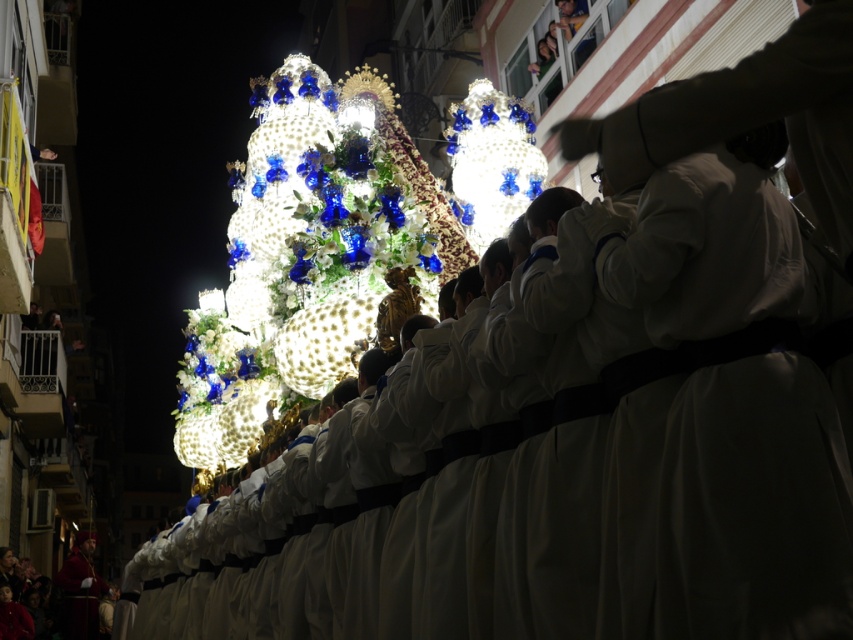
Is point (318, 310) more distant than point (490, 92)?

No.

Is illuminated glass christmas tree at center thinner than iridescent glass ornament at center?

Incorrect, illuminated glass christmas tree at center's width is not less than iridescent glass ornament at center's.

Which is behind, point (399, 189) or point (476, 113)?

Point (476, 113)

Find the location of a particular element. illuminated glass christmas tree at center is located at coordinates (297, 262).

Does illuminated glass christmas tree at center come in front of velvet red robe at lower left?

Yes.

Does illuminated glass christmas tree at center appear on the left side of velvet red robe at lower left?

No, illuminated glass christmas tree at center is not to the left of velvet red robe at lower left.

Measure the distance between point (259, 92) and camera.

A distance of 125.22 meters exists between point (259, 92) and camera.

The height and width of the screenshot is (640, 853). What are the coordinates of `illuminated glass christmas tree at center` in the screenshot? It's located at (297, 262).

Can you confirm if iridescent glass ornament at center is bigger than velvet red robe at lower left?

No, iridescent glass ornament at center is not bigger than velvet red robe at lower left.

Is point (460, 211) closer to viewer compared to point (96, 580)?

Yes, it is in front of point (96, 580).

At what (x,y) coordinates should I click in order to perform the action: click on iridescent glass ornament at center. Please return your answer as a coordinate pair (x, y). Looking at the image, I should click on (491, 161).